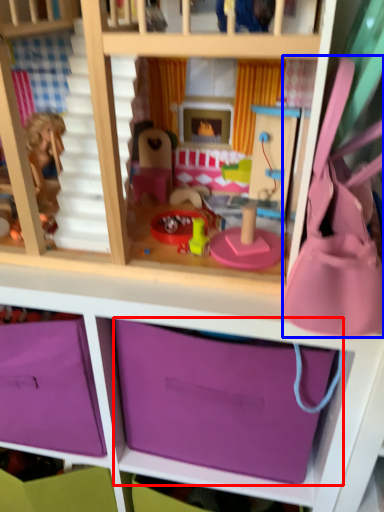
Question: Among these objects, which one is nearest to the camera, storage box (highlighted by a red box) or accessory (highlighted by a blue box)?

Choices:
 (A) storage box
 (B) accessory

Answer: (B)